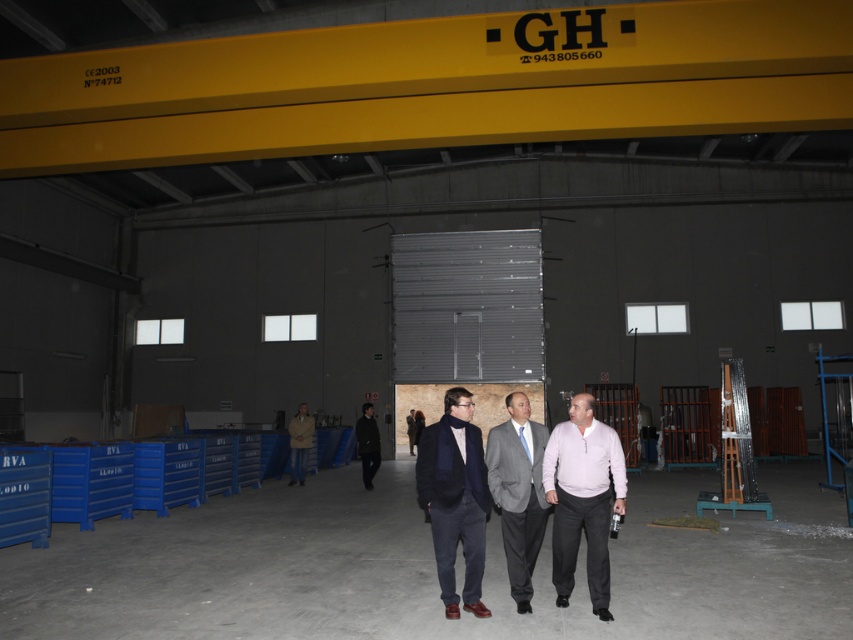
You are a photographer setting up a shoot in this industrial space. You have a lighting rig that requires at least 1.2 meters of clearance between the two people wearing the pink matte sweater at center and the dark brown leather jacket at center. Can you determine if the current spacing between them allows for this requirement?

The pink matte sweater at center might be wider than dark brown leather jacket at center, but the description does not provide specific measurements about the distance between them. Therefore, it is unclear if the 1.2 meters of clearance is available.

You are an observer in the warehouse and want to know if the gray suit at center is wider than the dark brown leather jacket at center. Can you determine this based on the scene?

The gray suit at center is wider than the dark brown leather jacket at center according to the description.